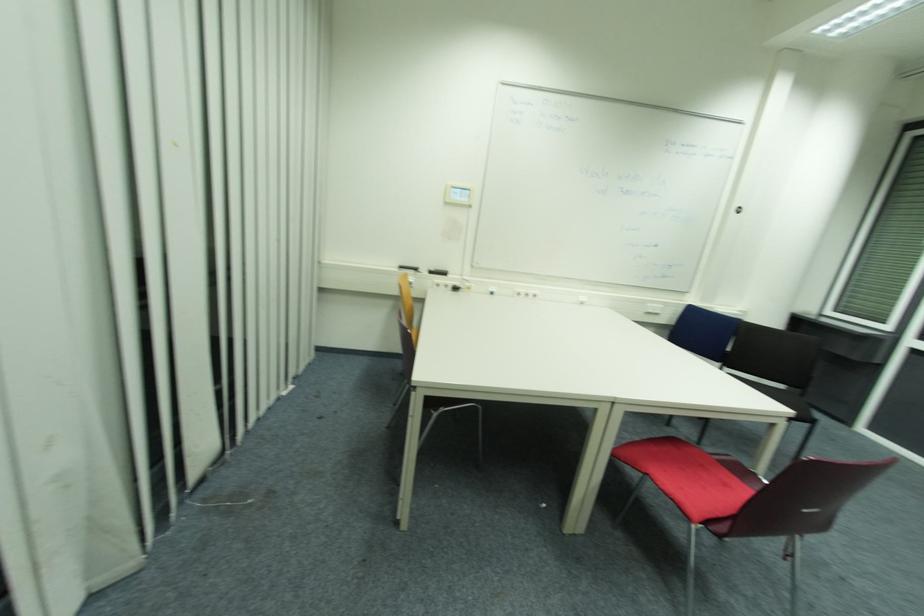
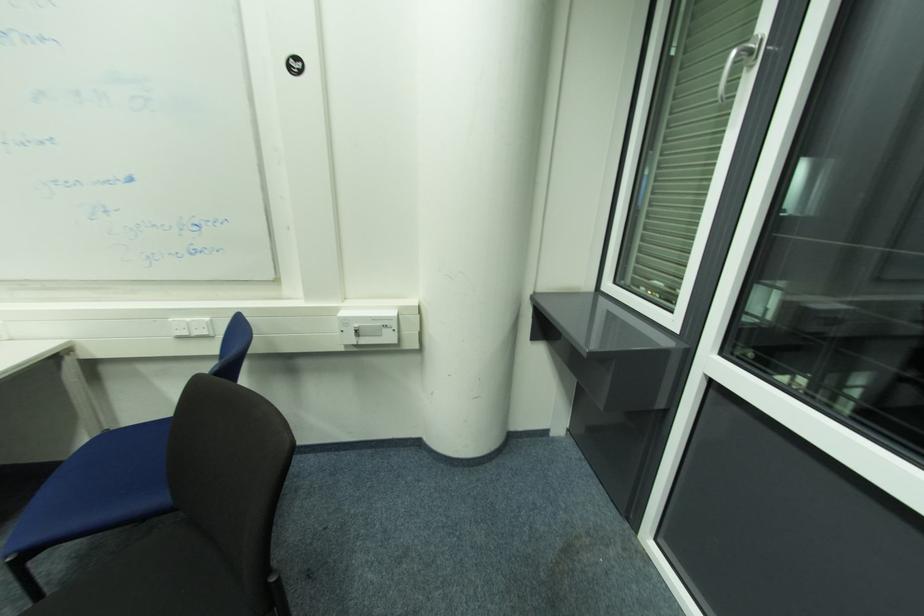
In the second image, find the point that corresponds to (x=736, y=315) in the first image.

(378, 320)